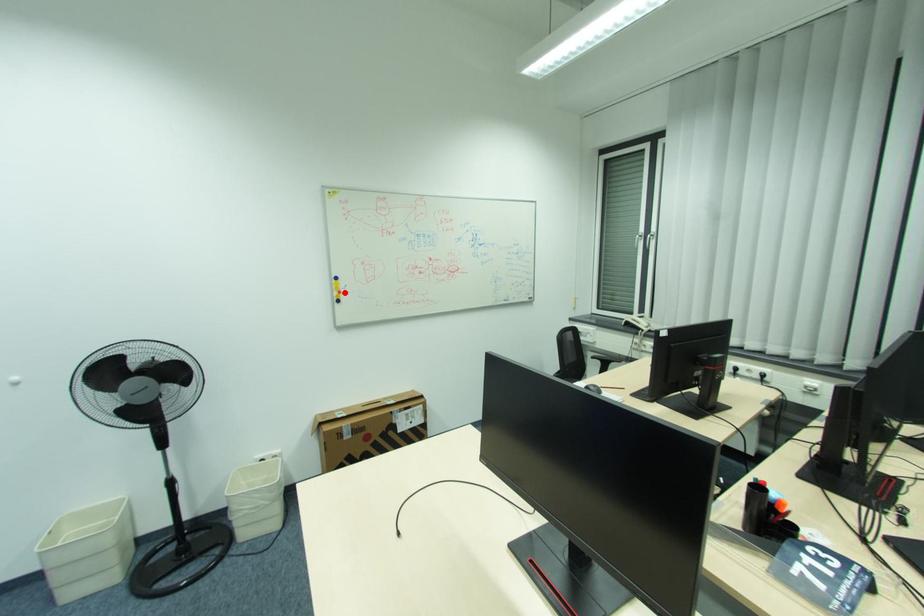
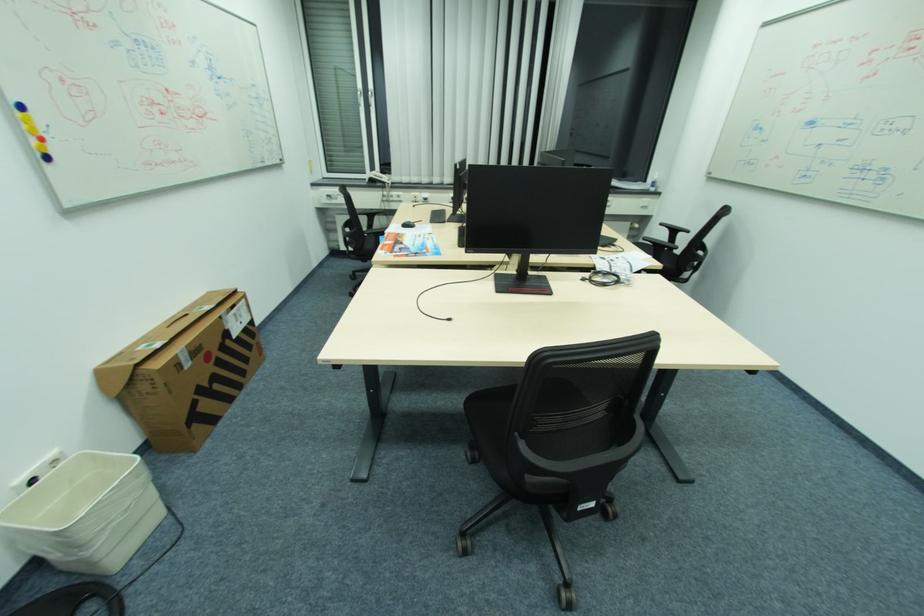
In the second image, find the point that corresponds to the highlighted location in the first image.

(44, 140)